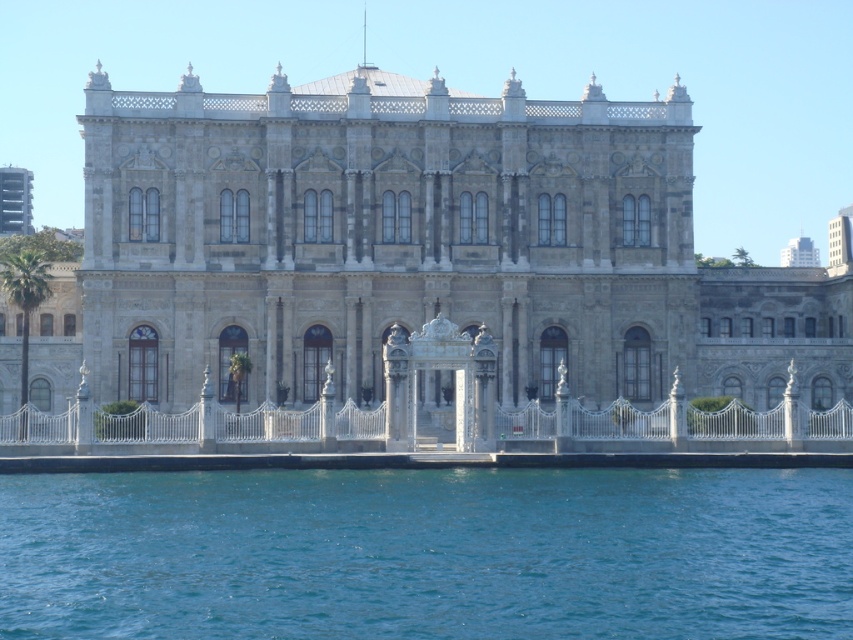
You are standing at the coordinates 0.5, 0.5 in the image. Which direction should you move to reach the stone building at center?

The stone building at center is located at point (413, 248), so you should move to the left and slightly downward from your current position at (426, 320) to reach it.

You are a city planner assessing the waterfront area. The stone building at center and the blue liquid water at lower center are both visible in your view. Which of these two features occupies a larger horizontal space in the image?

The stone building at center has a greater width than the blue liquid water at lower center, so it occupies a larger horizontal space in the image.